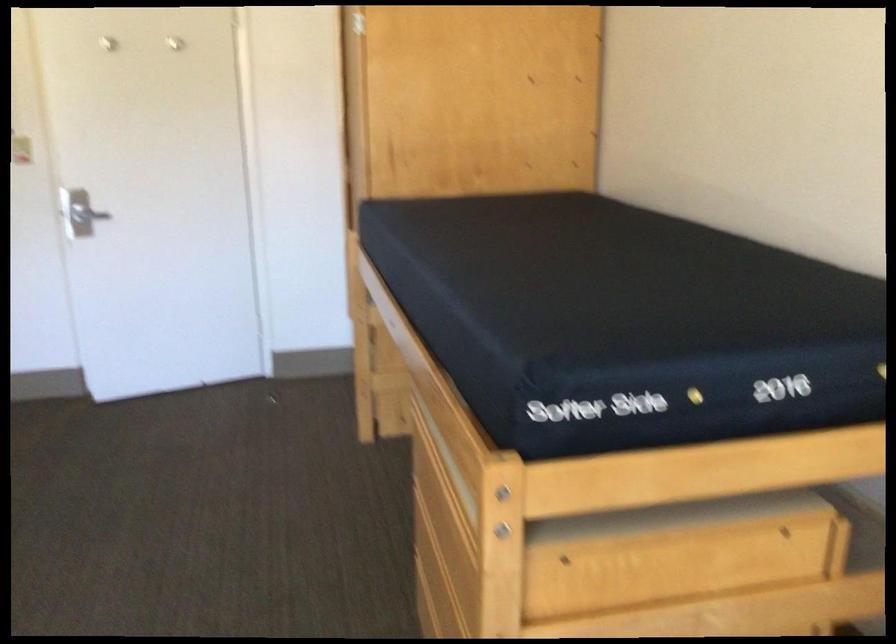
Locate an element on the screen. silver door handle is located at coordinates (87, 214).